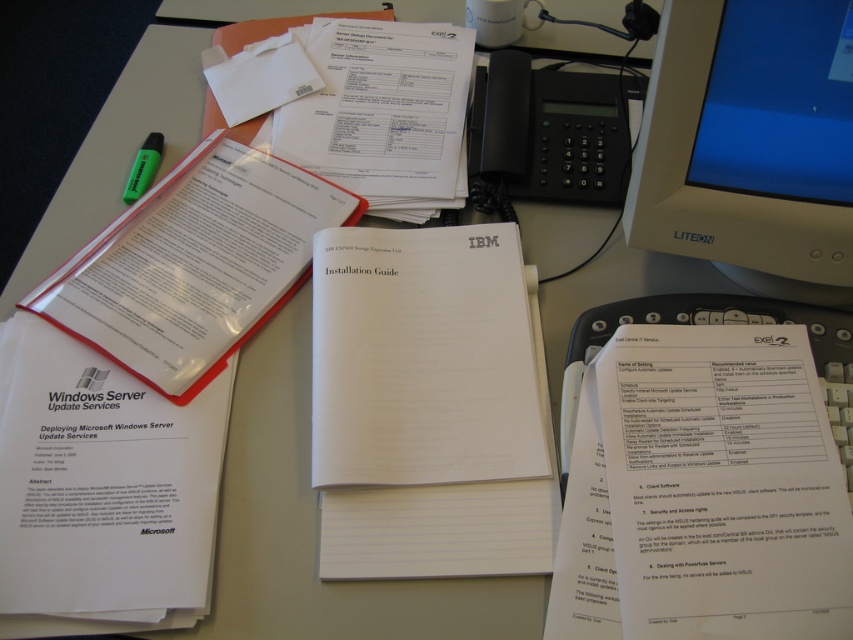
Question: Does white paper notepad at center lie in front of black plastic keyboard at center-right?

Choices:
 (A) no
 (B) yes

Answer: (B)

Question: Which of the following is the closest to the observer?

Choices:
 (A) white paper notepad at center
 (B) black plastic keyboard at center-right
 (C) white plastic monitor at upper right
 (D) white paper at lower left

Answer: (C)

Question: Does white paper notepad at center have a larger size compared to white paper at center?

Choices:
 (A) yes
 (B) no

Answer: (A)

Question: Is transparent plastic clipboard at upper center to the left of black plastic keyboard at center-right from the viewer's perspective?

Choices:
 (A) yes
 (B) no

Answer: (A)

Question: Among these points, which one is nearest to the camera?

Choices:
 (A) [640, 448]
 (B) [387, 301]
 (C) [206, 461]

Answer: (A)

Question: Which object is closer to the camera taking this photo?

Choices:
 (A) green matte highlighter at upper left
 (B) black plastic keyboard at center-right
 (C) white paper at lower left
 (D) white plastic monitor at upper right

Answer: (D)